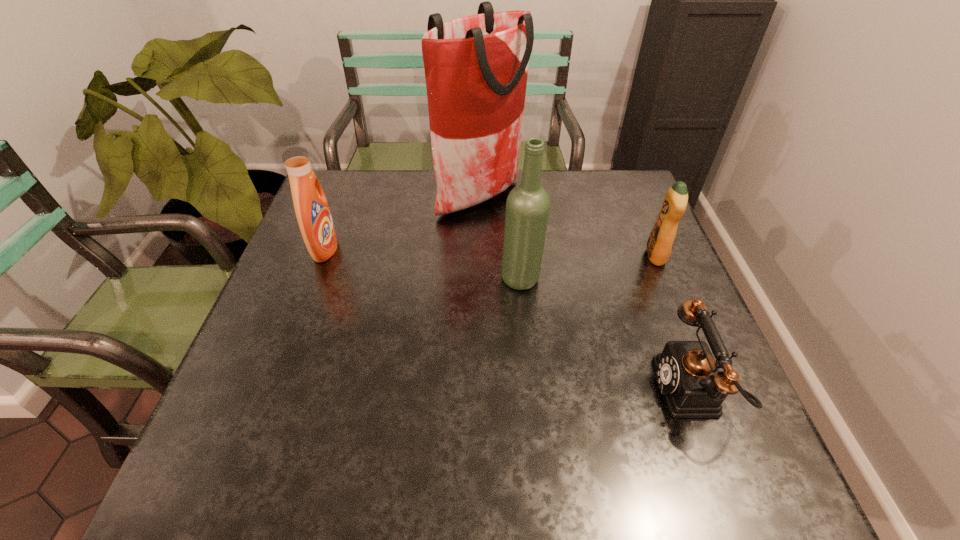
I want to click on free space located on the back of the fourth shortest object, so click(x=517, y=247).

You are a GUI agent. You are given a task and a screenshot of the screen. Output one action in this format:
    pyautogui.click(x=<x>, y=<y>)
    Task: Click on the vacant space located on the front-facing side of the third tallest object
    The width and height of the screenshot is (960, 540).
    Given the screenshot: What is the action you would take?
    pyautogui.click(x=452, y=249)

The width and height of the screenshot is (960, 540). Find the location of `free space located on the label of the second shortest object`. free space located on the label of the second shortest object is located at coordinates (520, 256).

This screenshot has height=540, width=960. Find the location of `vacant space located on the label of the second shortest object`. vacant space located on the label of the second shortest object is located at coordinates (493, 256).

Find the location of a particular element. free space located 0.150m on the label of the second shortest object is located at coordinates (588, 256).

Find the location of a particular element. This screenshot has width=960, height=540. vacant position located on the front of the nearest object at the rotary dial is located at coordinates (582, 390).

In order to click on free space located 0.130m on the front of the nearest object at the rotary dial in this screenshot , I will do `click(591, 390)`.

Identify the location of free region located 0.240m on the front of the nearest object at the rotary dial. The height and width of the screenshot is (540, 960). (537, 390).

You are a GUI agent. You are given a task and a screenshot of the screen. Output one action in this format:
    pyautogui.click(x=<x>, y=<y>)
    Task: Click on the object positioned at the far edge
    This screenshot has height=540, width=960.
    Given the screenshot: What is the action you would take?
    pyautogui.click(x=476, y=67)

At what (x,y) coordinates should I click in order to perform the action: click on object that is at the left edge. Please return your answer as a coordinate pair (x, y). This screenshot has height=540, width=960. Looking at the image, I should click on (312, 211).